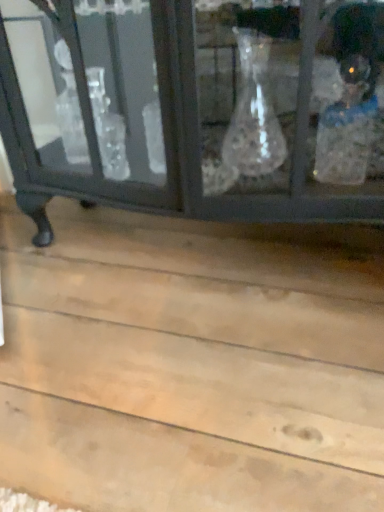
Question: Is natural wood plank at lower center facing away from matte black cabinet at upper center?

Choices:
 (A) no
 (B) yes

Answer: (A)

Question: Does natural wood plank at lower center have a lesser width compared to matte black cabinet at upper center?

Choices:
 (A) no
 (B) yes

Answer: (A)

Question: Is natural wood plank at lower center further to the viewer compared to matte black cabinet at upper center?

Choices:
 (A) no
 (B) yes

Answer: (A)

Question: Can you confirm if natural wood plank at lower center is bigger than matte black cabinet at upper center?

Choices:
 (A) no
 (B) yes

Answer: (A)

Question: Can you confirm if natural wood plank at lower center is shorter than matte black cabinet at upper center?

Choices:
 (A) yes
 (B) no

Answer: (A)

Question: Can we say natural wood plank at lower center lies outside matte black cabinet at upper center?

Choices:
 (A) no
 (B) yes

Answer: (B)

Question: Does matte black cabinet at upper center have a greater height compared to natural wood plank at lower center?

Choices:
 (A) yes
 (B) no

Answer: (A)

Question: Is matte black cabinet at upper center to the left of natural wood plank at lower center from the viewer's perspective?

Choices:
 (A) yes
 (B) no

Answer: (B)

Question: Can you confirm if matte black cabinet at upper center is bigger than natural wood plank at lower center?

Choices:
 (A) yes
 (B) no

Answer: (A)

Question: Is matte black cabinet at upper center smaller than natural wood plank at lower center?

Choices:
 (A) no
 (B) yes

Answer: (A)

Question: From a real-world perspective, is matte black cabinet at upper center located beneath natural wood plank at lower center?

Choices:
 (A) no
 (B) yes

Answer: (A)

Question: From the image's perspective, is matte black cabinet at upper center above natural wood plank at lower center?

Choices:
 (A) no
 (B) yes

Answer: (B)

Question: From a real-world perspective, is matte black cabinet at upper center above or below natural wood plank at lower center?

Choices:
 (A) above
 (B) below

Answer: (A)